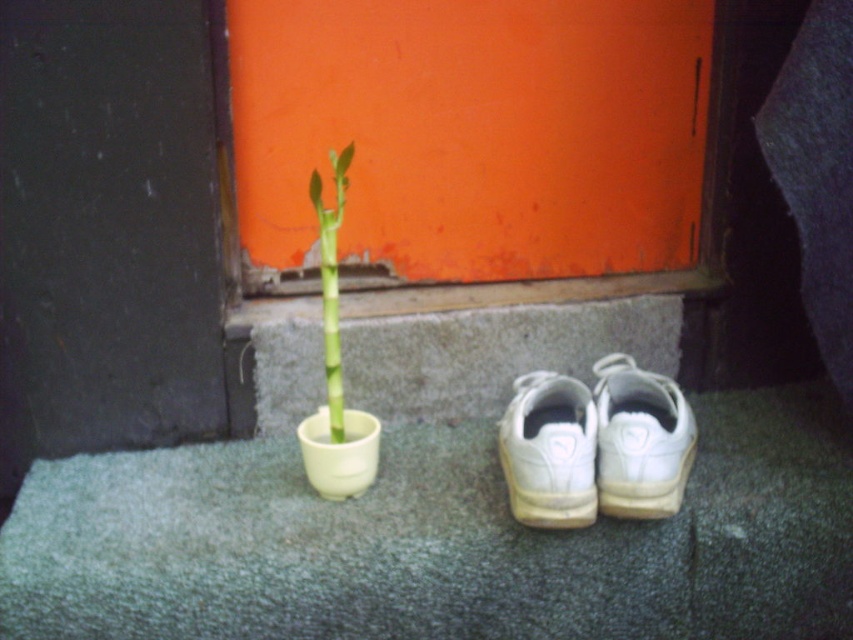
Question: Which object is farther from the camera taking this photo?

Choices:
 (A) green glossy bamboo at center
 (B) white leather shoe at center

Answer: (A)

Question: Does white leather shoe at center appear on the left side of white leather sneakers at lower center?

Choices:
 (A) no
 (B) yes

Answer: (A)

Question: Is white leather shoe at center positioned behind white leather sneakers at lower center?

Choices:
 (A) no
 (B) yes

Answer: (B)

Question: Does white leather sneakers at lower center come in front of green glossy bamboo at center?

Choices:
 (A) no
 (B) yes

Answer: (B)

Question: Based on their relative distances, which object is nearer to the white leather sneakers at lower center?

Choices:
 (A) white leather shoe at center
 (B) green glossy bamboo at center

Answer: (A)

Question: Which of these objects is positioned closest to the green glossy bamboo at center?

Choices:
 (A) white leather shoe at center
 (B) white leather sneakers at lower center

Answer: (B)